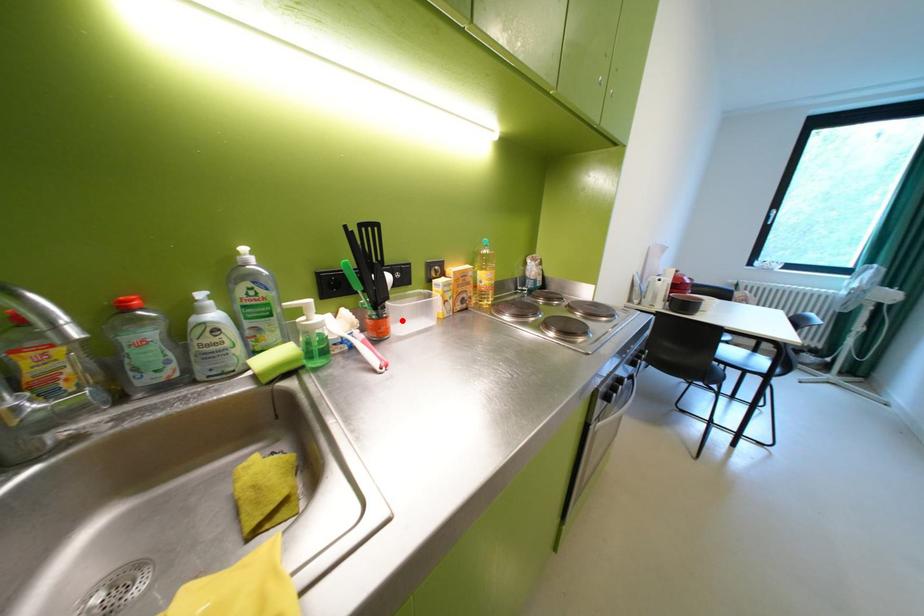
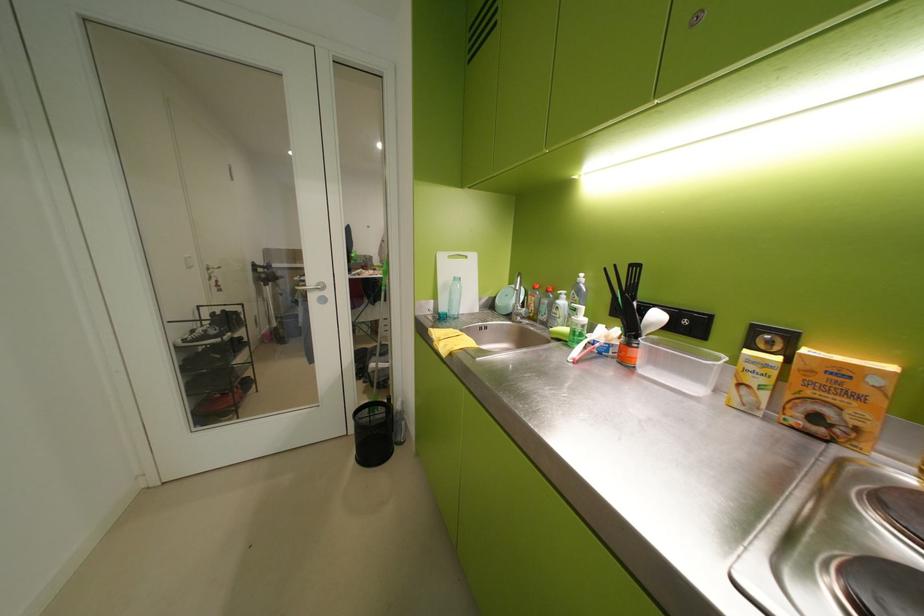
Find the pixel in the second image that matches the highlighted location in the first image.

(650, 354)